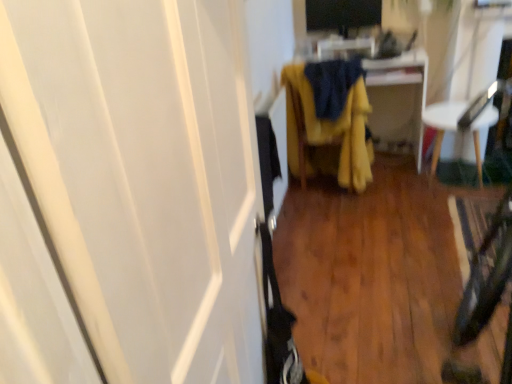
Measure the distance between yellow fabric chair at center, which appears as the first furniture when viewed from the left, and camera.

The depth of yellow fabric chair at center, which appears as the first furniture when viewed from the left, is 2.54 meters.

Find the location of a particular element. yellow fabric at center is located at coordinates (398, 101).

Is white glossy screen door at left spatially inside white plastic chair at right, which is the 2th furniture from left to right, or outside of it?

white glossy screen door at left lies outside white plastic chair at right, which is the 2th furniture from left to right.

Is point (67, 140) less distant than point (432, 169)?

Yes, point (67, 140) is in front of point (432, 169).

In the scene shown: Which is behind, white glossy screen door at left or white plastic chair at right, which is the 2th furniture from left to right?

Positioned behind is white plastic chair at right, which is the 2th furniture from left to right.

From the image's perspective, is white glossy screen door at left above or below white plastic chair at right, which is the 2th furniture from left to right?

white glossy screen door at left is below white plastic chair at right, which is the 2th furniture from left to right.

Identify the location of cabinetry on the right of yellow fabric chair at center, which appears as the first furniture when viewed from the left. (398, 101).

Can you confirm if yellow fabric at center is thinner than yellow fabric chair at center, which is the second furniture in right-to-left order?

Indeed, yellow fabric at center has a lesser width compared to yellow fabric chair at center, which is the second furniture in right-to-left order.

Is yellow fabric at center next to yellow fabric chair at center, which is the second furniture in right-to-left order, and touching it?

There is a gap between yellow fabric at center and yellow fabric chair at center, which is the second furniture in right-to-left order.

Based on the photo, does yellow fabric at center lie in front of yellow fabric chair at center, which appears as the first furniture when viewed from the left?

No, yellow fabric at center is further to the viewer.

Is black glossy monitor at upper center at the right side of yellow fabric chair at center, which is the second furniture in right-to-left order?

Yes.

From the image's perspective, is black glossy monitor at upper center located above or below yellow fabric chair at center, which appears as the first furniture when viewed from the left?

black glossy monitor at upper center is above yellow fabric chair at center, which appears as the first furniture when viewed from the left.

Which object is closer to the camera, black glossy monitor at upper center or yellow fabric chair at center, which is the second furniture in right-to-left order?

yellow fabric chair at center, which is the second furniture in right-to-left order, is more forward.

Which is more to the left, white plastic chair at right, which is the first furniture in right-to-left order, or yellow fabric chair at center, which appears as the first furniture when viewed from the left?

yellow fabric chair at center, which appears as the first furniture when viewed from the left, is more to the left.

Is white plastic chair at right, which is the first furniture in right-to-left order, bigger than yellow fabric chair at center, which is the second furniture in right-to-left order?

No, white plastic chair at right, which is the first furniture in right-to-left order, is not bigger than yellow fabric chair at center, which is the second furniture in right-to-left order.

Is the position of white plastic chair at right, which is the first furniture in right-to-left order, more distant than that of yellow fabric chair at center, which appears as the first furniture when viewed from the left?

Yes, white plastic chair at right, which is the first furniture in right-to-left order, is further from the camera.

From the white glossy screen door at left, count 1st furniture to the right and point to it. Please provide its 2D coordinates.

[(330, 133)]

Is yellow fabric chair at center, which is the second furniture in right-to-left order, positioned with its back to white glossy screen door at left?

Yes, yellow fabric chair at center, which is the second furniture in right-to-left order, is facing away from white glossy screen door at left.

Is yellow fabric chair at center, which is the second furniture in right-to-left order, located outside white glossy screen door at left?

Absolutely, yellow fabric chair at center, which is the second furniture in right-to-left order, is external to white glossy screen door at left.

Considering the sizes of yellow fabric chair at center, which appears as the first furniture when viewed from the left, and white glossy screen door at left in the image, is yellow fabric chair at center, which appears as the first furniture when viewed from the left, taller or shorter than white glossy screen door at left?

Clearly, yellow fabric chair at center, which appears as the first furniture when viewed from the left, is shorter compared to white glossy screen door at left.

Looking at this image, based on their sizes in the image, would you say white glossy screen door at left is bigger or smaller than yellow fabric chair at center, which appears as the first furniture when viewed from the left?

In the image, white glossy screen door at left appears to be smaller than yellow fabric chair at center, which appears as the first furniture when viewed from the left.

Which object is positioned more to the right, white glossy screen door at left or yellow fabric chair at center, which appears as the first furniture when viewed from the left?

From the viewer's perspective, yellow fabric chair at center, which appears as the first furniture when viewed from the left, appears more on the right side.

Would you consider white glossy screen door at left to be distant from yellow fabric chair at center, which is the second furniture in right-to-left order?

Yes, white glossy screen door at left and yellow fabric chair at center, which is the second furniture in right-to-left order, are quite far apart.

Is yellow fabric chair at center, which is the second furniture in right-to-left order, inside white glossy screen door at left?

No, yellow fabric chair at center, which is the second furniture in right-to-left order, is located outside of white glossy screen door at left.

Which is more to the left, yellow fabric chair at center, which is the second furniture in right-to-left order, or black glossy monitor at upper center?

yellow fabric chair at center, which is the second furniture in right-to-left order.

Is the depth of yellow fabric chair at center, which is the second furniture in right-to-left order, less than that of black glossy monitor at upper center?

Yes, yellow fabric chair at center, which is the second furniture in right-to-left order, is in front of black glossy monitor at upper center.

Considering the relative sizes of yellow fabric chair at center, which appears as the first furniture when viewed from the left, and black glossy monitor at upper center in the image provided, is yellow fabric chair at center, which appears as the first furniture when viewed from the left, smaller than black glossy monitor at upper center?

Actually, yellow fabric chair at center, which appears as the first furniture when viewed from the left, might be larger than black glossy monitor at upper center.

From the image's perspective, between yellow fabric chair at center, which appears as the first furniture when viewed from the left, and black glossy monitor at upper center, which one is located above?

black glossy monitor at upper center, from the image's perspective.

There is a white glossy screen door at left. In order to click on the 1st furniture above it (from the image's perspective) in this screenshot , I will do `click(463, 121)`.

Locate an element on the screen. Image resolution: width=512 pixels, height=384 pixels. the 2nd furniture in front of the yellow fabric at center is located at coordinates (330, 133).

Which object lies nearer to the anchor point black glossy monitor at upper center, yellow fabric chair at center, which is the second furniture in right-to-left order, or white plastic chair at right, which is the 2th furniture from left to right?

yellow fabric chair at center, which is the second furniture in right-to-left order, lies closer to black glossy monitor at upper center than the other object.

When comparing their distances from white glossy screen door at left, does white plastic chair at right, which is the 2th furniture from left to right, or black glossy monitor at upper center seem closer?

Based on the image, white plastic chair at right, which is the 2th furniture from left to right, appears to be nearer to white glossy screen door at left.

From the image, which object appears to be farther from yellow fabric chair at center, which is the second furniture in right-to-left order, yellow fabric at center or black glossy monitor at upper center?

black glossy monitor at upper center is further to yellow fabric chair at center, which is the second furniture in right-to-left order.

Looking at the image, which one is located closer to white plastic chair at right, which is the first furniture in right-to-left order, yellow fabric at center or yellow fabric chair at center, which appears as the first furniture when viewed from the left?

yellow fabric at center lies closer to white plastic chair at right, which is the first furniture in right-to-left order, than the other object.

Looking at the image, which one is located further to white glossy screen door at left, yellow fabric at center or white plastic chair at right, which is the first furniture in right-to-left order?

The object further to white glossy screen door at left is yellow fabric at center.

When comparing their distances from white plastic chair at right, which is the first furniture in right-to-left order, does yellow fabric chair at center, which is the second furniture in right-to-left order, or black glossy monitor at upper center seem closer?

The object closer to white plastic chair at right, which is the first furniture in right-to-left order, is yellow fabric chair at center, which is the second furniture in right-to-left order.

When comparing their distances from yellow fabric chair at center, which appears as the first furniture when viewed from the left, does black glossy monitor at upper center or yellow fabric at center seem further?

The object further to yellow fabric chair at center, which appears as the first furniture when viewed from the left, is black glossy monitor at upper center.

Which object lies nearer to the anchor point white plastic chair at right, which is the first furniture in right-to-left order, white glossy screen door at left or black glossy monitor at upper center?

black glossy monitor at upper center is positioned closer to the anchor white plastic chair at right, which is the first furniture in right-to-left order.

Where is `cabinetry situated between yellow fabric chair at center, which appears as the first furniture when viewed from the left, and white plastic chair at right, which is the first furniture in right-to-left order, from left to right`? The width and height of the screenshot is (512, 384). cabinetry situated between yellow fabric chair at center, which appears as the first furniture when viewed from the left, and white plastic chair at right, which is the first furniture in right-to-left order, from left to right is located at coordinates (398, 101).

Locate an element on the screen. cabinetry between black glossy monitor at upper center and white plastic chair at right, which is the first furniture in right-to-left order, vertically is located at coordinates (398, 101).

Locate an element on the screen. cabinetry between white glossy screen door at left and black glossy monitor at upper center in the front-back direction is located at coordinates (398, 101).

Find the location of a particular element. This screenshot has width=512, height=384. furniture between black glossy monitor at upper center and white plastic chair at right, which is the 2th furniture from left to right, from top to bottom is located at coordinates (330, 133).